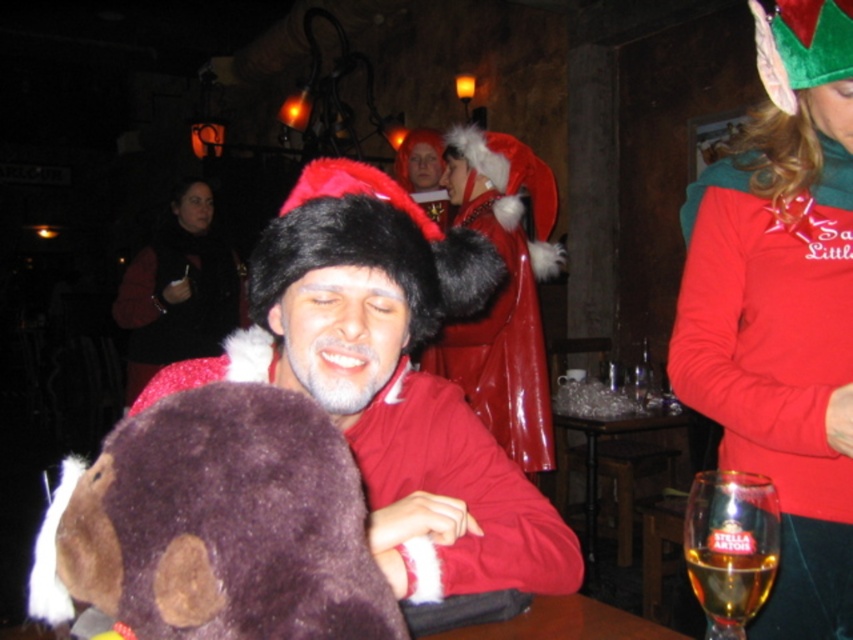
Consider the image. Does velvet green hat at upper right appear on the right side of velvet black vest at center?

Indeed, velvet green hat at upper right is positioned on the right side of velvet black vest at center.

Can you confirm if velvet green hat at upper right is shorter than velvet black vest at center?

Yes.

Between point (755, 433) and point (183, 291), which one is positioned behind?

Positioned behind is point (183, 291).

What are the coordinates of `velvet green hat at upper right` in the screenshot? It's located at (782, 307).

Does fuzzy red coat at center appear over velvet black vest at center?

No, fuzzy red coat at center is not above velvet black vest at center.

Which of these two, fuzzy red coat at center or velvet black vest at center, stands shorter?

Standing shorter between the two is fuzzy red coat at center.

I want to click on fuzzy red coat at center, so click(x=392, y=381).

Can you confirm if velvet green hat at upper right is positioned to the right of brown plush bear at center?

Yes, velvet green hat at upper right is to the right of brown plush bear at center.

Does velvet green hat at upper right have a lesser height compared to brown plush bear at center?

No, velvet green hat at upper right is not shorter than brown plush bear at center.

Identify the location of velvet green hat at upper right. The width and height of the screenshot is (853, 640). (782, 307).

Identify the location of velvet green hat at upper right. (782, 307).